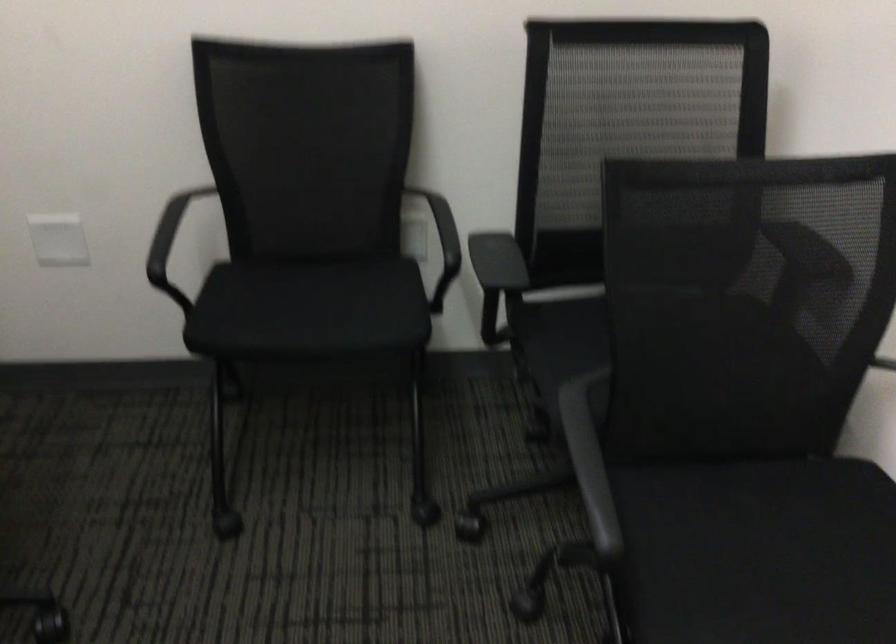
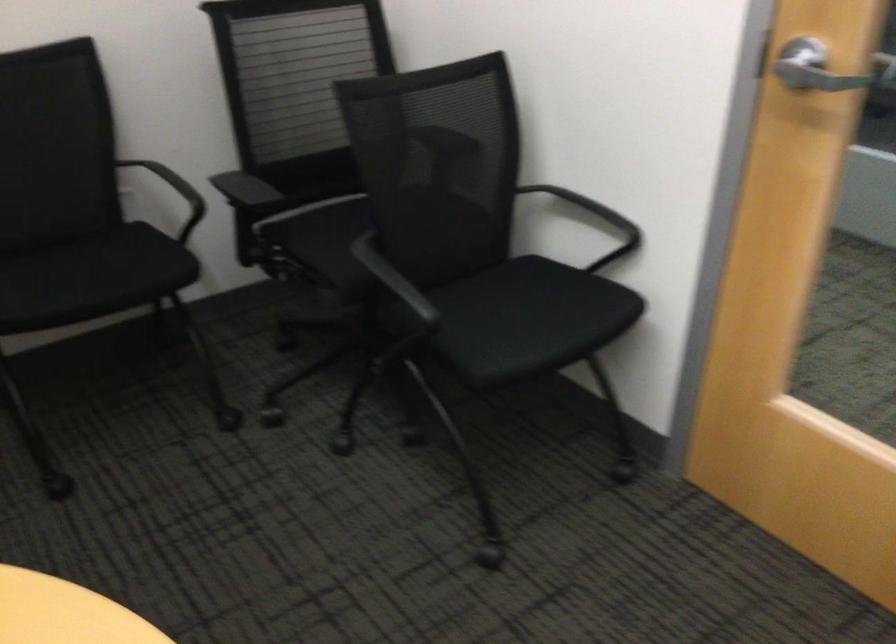
In the second image, find the point that corresponds to pixel 806 573 in the first image.

(528, 319)